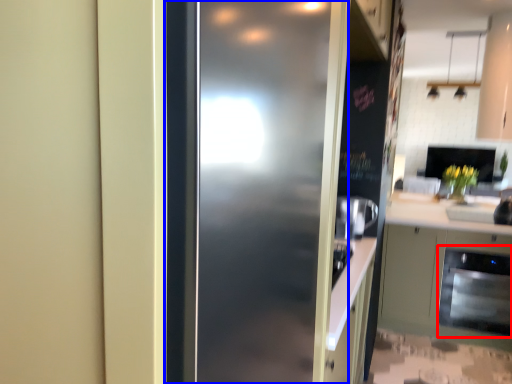
Question: Which of the following is the closest to the observer, dish washer (highlighted by a red box) or door (highlighted by a blue box)?

Choices:
 (A) dish washer
 (B) door

Answer: (B)